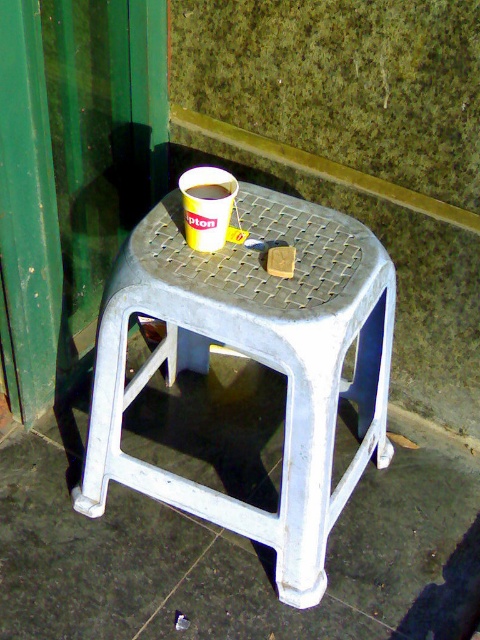
You are setting up a small table for a coffee break. You have a white plastic stool at center and a matte yellow cup at center. Which object should you place first if you want to ensure there is enough space for both?

You should place the white plastic stool at center first because it is larger in size than the matte yellow cup at center, ensuring there is enough space left for the smaller item.

You are a barista who needs to deliver two cups to a customer. You see the yellow paper cup at center and the matte yellow cup at center. Which cup is on the right side?

The matte yellow cup at center is on the right side because the yellow paper cup at center is positioned on its left side.